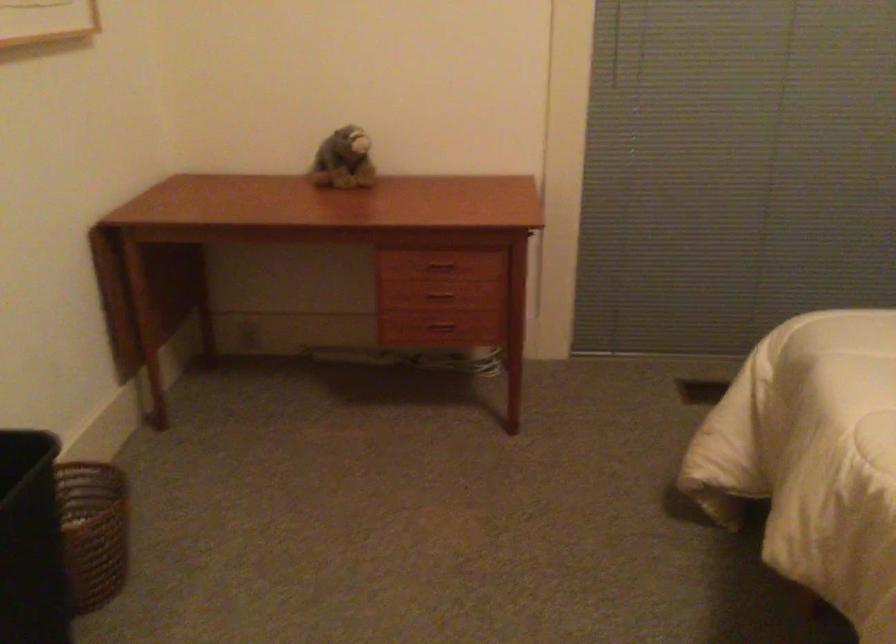
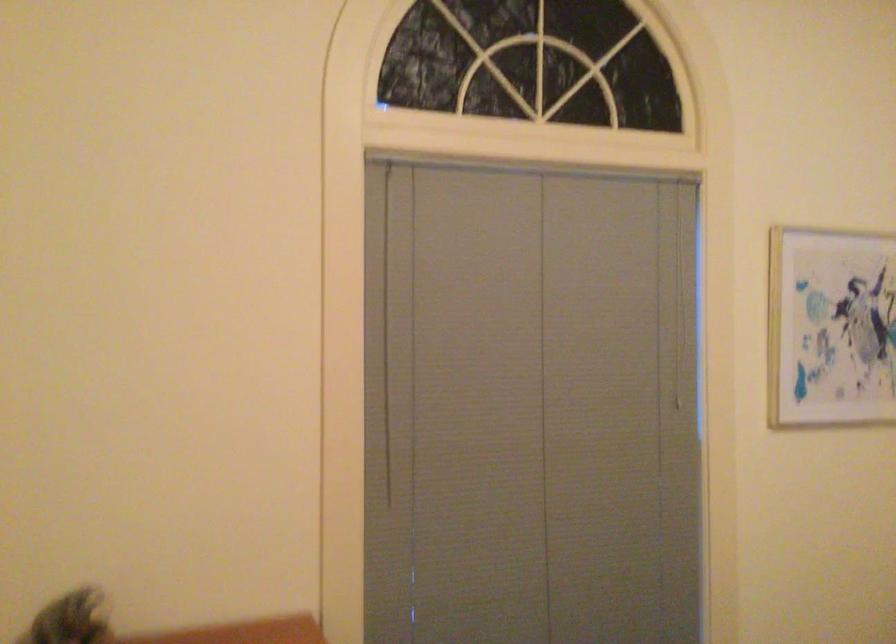
The first image is from the beginning of the video and the second image is from the end. How did the camera likely rotate when shooting the video?

The camera rotated toward right-up.